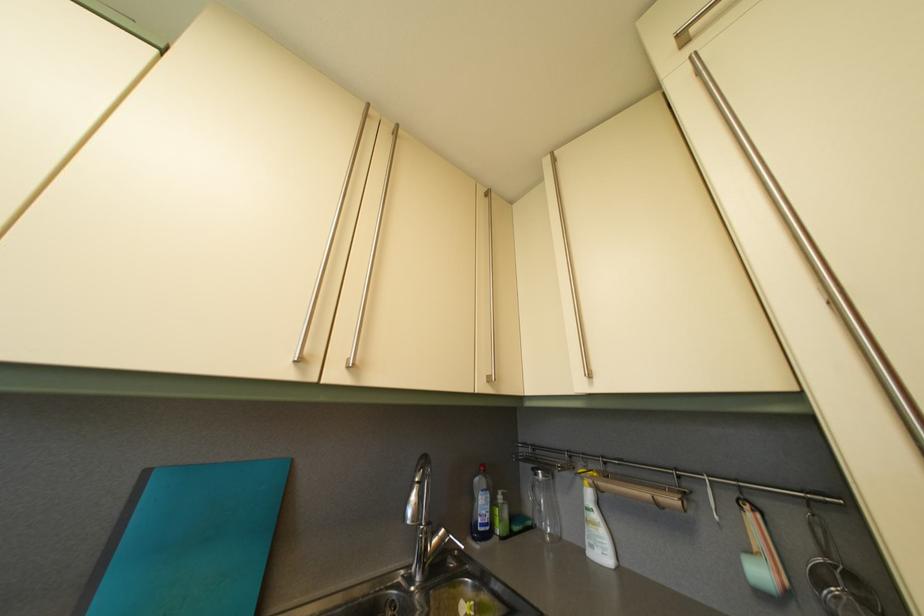
Where is `faucet handle`? This screenshot has height=616, width=924. faucet handle is located at coordinates (441, 543).